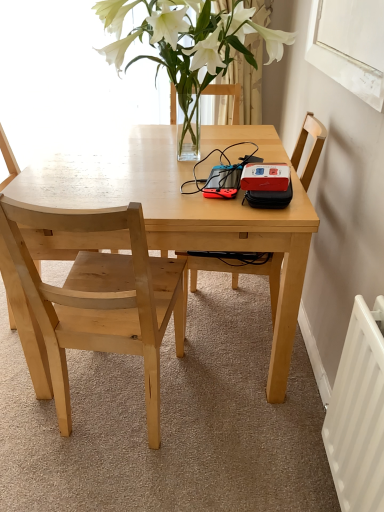
Question: Considering the relative sizes of wooden chair at center, the 1th chair in the right-to-left sequence, and white matte window screen at upper right in the image provided, is wooden chair at center, the 1th chair in the right-to-left sequence, bigger than white matte window screen at upper right?

Choices:
 (A) yes
 (B) no

Answer: (A)

Question: Is wooden chair at center, the 3th chair in the left-to-right sequence, completely or partially outside of white matte window screen at upper right?

Choices:
 (A) no
 (B) yes

Answer: (B)

Question: Is wooden chair at center, the 1th chair in the right-to-left sequence, not close to white matte window screen at upper right?

Choices:
 (A) no
 (B) yes

Answer: (A)

Question: Is wooden chair at center, the 1th chair in the right-to-left sequence, wider than white matte window screen at upper right?

Choices:
 (A) yes
 (B) no

Answer: (A)

Question: Is wooden chair at center, the 1th chair in the right-to-left sequence, further to the viewer compared to white matte window screen at upper right?

Choices:
 (A) yes
 (B) no

Answer: (A)

Question: Is wooden chair at center, the 3th chair in the left-to-right sequence, with white matte window screen at upper right?

Choices:
 (A) yes
 (B) no

Answer: (B)

Question: Can you confirm if light wood chair at left, positioned as the 2th chair in left-to-right order, is bigger than white matte window screen at upper right?

Choices:
 (A) no
 (B) yes

Answer: (B)

Question: Is light wood chair at left, positioned as the 2th chair in left-to-right order, taller than white matte window screen at upper right?

Choices:
 (A) no
 (B) yes

Answer: (B)

Question: Is white matte window screen at upper right at the back of light wood chair at left, the 2th chair viewed from the right?

Choices:
 (A) no
 (B) yes

Answer: (A)

Question: From the image's perspective, would you say light wood chair at left, the 2th chair viewed from the right, is positioned over white matte window screen at upper right?

Choices:
 (A) yes
 (B) no

Answer: (B)

Question: From the image's perspective, does light wood chair at left, positioned as the 2th chair in left-to-right order, appear lower than white matte window screen at upper right?

Choices:
 (A) yes
 (B) no

Answer: (A)

Question: Are light wood chair at left, the 2th chair viewed from the right, and white matte window screen at upper right far apart?

Choices:
 (A) no
 (B) yes

Answer: (A)

Question: Is translucent glass vase at upper center looking in the opposite direction of wooden chair at center, the 3th chair in the left-to-right sequence?

Choices:
 (A) no
 (B) yes

Answer: (A)